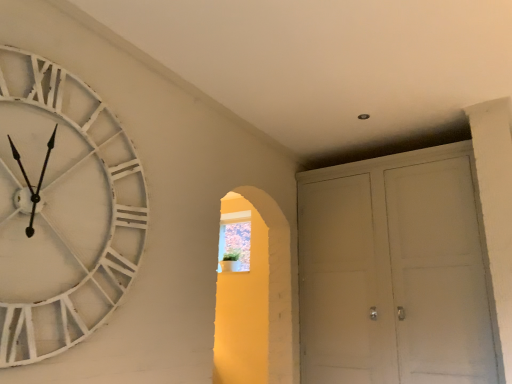
Question: From a real-world perspective, does translucent glass window at center stand above white distressed wood clock at left?

Choices:
 (A) no
 (B) yes

Answer: (B)

Question: Does translucent glass window at center have a lesser width compared to white distressed wood clock at left?

Choices:
 (A) yes
 (B) no

Answer: (B)

Question: From a real-world perspective, does translucent glass window at center sit lower than white distressed wood clock at left?

Choices:
 (A) no
 (B) yes

Answer: (A)

Question: Considering the relative sizes of translucent glass window at center and white distressed wood clock at left in the image provided, is translucent glass window at center shorter than white distressed wood clock at left?

Choices:
 (A) yes
 (B) no

Answer: (A)

Question: Is translucent glass window at center to the right of white distressed wood clock at left from the viewer's perspective?

Choices:
 (A) no
 (B) yes

Answer: (B)

Question: Relative to white distressed wood clock at left, is white matte cabinet at right in front or behind?

Choices:
 (A) behind
 (B) front

Answer: (A)

Question: In the image, is white matte cabinet at right on the left side or the right side of white distressed wood clock at left?

Choices:
 (A) left
 (B) right

Answer: (B)

Question: From a real-world perspective, is white matte cabinet at right positioned above or below white distressed wood clock at left?

Choices:
 (A) above
 (B) below

Answer: (B)

Question: From the image's perspective, is white matte cabinet at right above or below white distressed wood clock at left?

Choices:
 (A) below
 (B) above

Answer: (A)

Question: Looking at their shapes, would you say translucent glass window at center is wider or thinner than white distressed wood clock at left?

Choices:
 (A) wide
 (B) thin

Answer: (A)

Question: Looking at the image, does translucent glass window at center seem bigger or smaller compared to white distressed wood clock at left?

Choices:
 (A) big
 (B) small

Answer: (B)

Question: From a real-world perspective, is translucent glass window at center positioned above or below white distressed wood clock at left?

Choices:
 (A) below
 (B) above

Answer: (B)

Question: From their relative heights in the image, would you say translucent glass window at center is taller or shorter than white distressed wood clock at left?

Choices:
 (A) short
 (B) tall

Answer: (A)

Question: Considering the positions of point (227, 230) and point (365, 326), is point (227, 230) closer or farther from the camera than point (365, 326)?

Choices:
 (A) farther
 (B) closer

Answer: (A)

Question: Looking at their shapes, would you say translucent glass window at center is wider or thinner than white matte cabinet at right?

Choices:
 (A) wide
 (B) thin

Answer: (B)